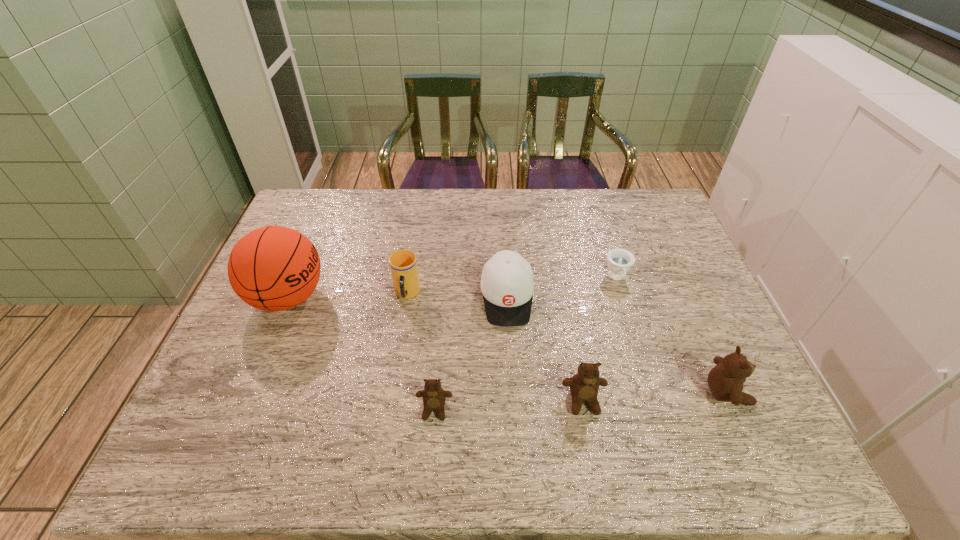
You are a GUI agent. You are given a task and a screenshot of the screen. Output one action in this format:
    pyautogui.click(x=<x>, y=<y>)
    Task: Click on the sixth tallest object
    
    Given the screenshot: What is the action you would take?
    pyautogui.click(x=434, y=397)

Locate an element on the screen. the leftmost teddy bear is located at coordinates (434, 397).

Identify the location of the second tallest teddy bear. This screenshot has height=540, width=960. (584, 386).

Locate an element on the screen. The image size is (960, 540). the fifth object from left to right is located at coordinates (584, 386).

At what (x,y) coordinates should I click in order to perform the action: click on the tallest teddy bear. Please return your answer as a coordinate pair (x, y). Looking at the image, I should click on (725, 380).

Where is `the rightmost object`? This screenshot has height=540, width=960. the rightmost object is located at coordinates (725, 380).

This screenshot has height=540, width=960. I want to click on the sixth object from right to left, so click(403, 264).

Locate an element on the screen. The image size is (960, 540). the sixth object from left to right is located at coordinates (619, 260).

Find the location of a particular element. The height and width of the screenshot is (540, 960). teacup is located at coordinates (619, 260).

This screenshot has height=540, width=960. In order to click on basketball in this screenshot , I will do `click(274, 268)`.